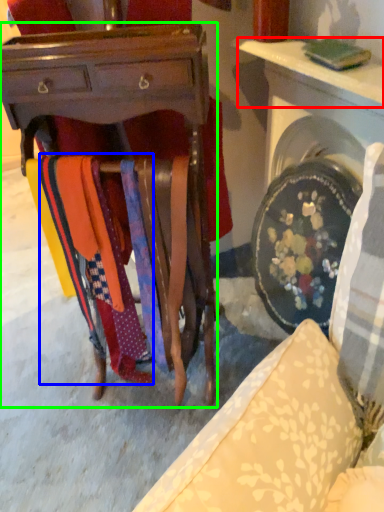
Question: Based on their relative distances, which object is nearer to table (highlighted by a red box)? Choose from fabric (highlighted by a blue box) and desk (highlighted by a green box).

Choices:
 (A) fabric
 (B) desk

Answer: (B)